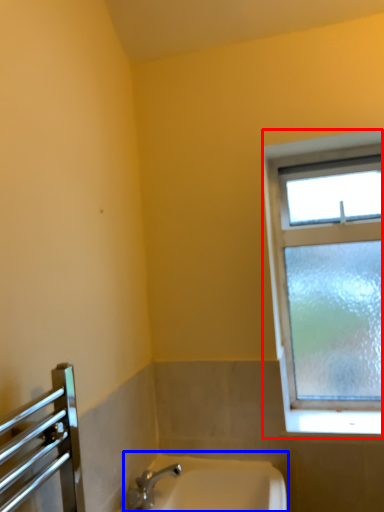
Question: Which object appears farthest to the camera in this image, window (highlighted by a red box) or sink (highlighted by a blue box)?

Choices:
 (A) window
 (B) sink

Answer: (A)